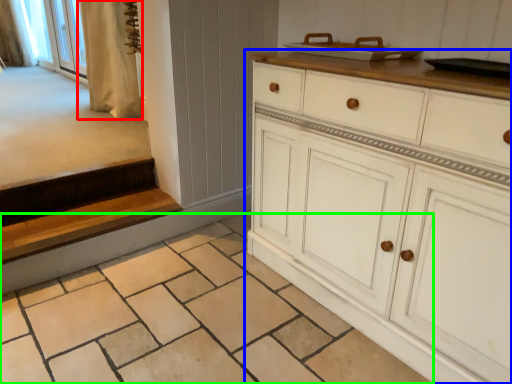
Question: Which object is the farthest from curtain (highlighted by a red box)? Choose among these: chest of drawers (highlighted by a blue box) or tile (highlighted by a green box).

Choices:
 (A) chest of drawers
 (B) tile

Answer: (A)